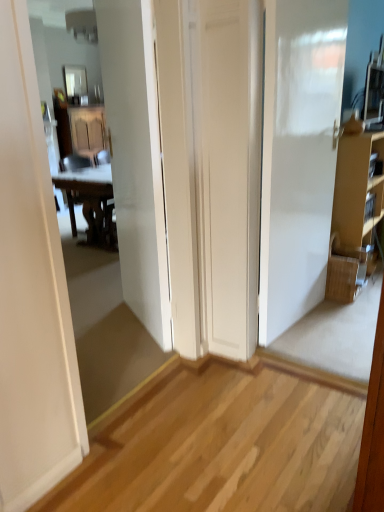
Question: From the image's perspective, relative to glossy glass mirror at upper center, is woven brown picnic basket at right above or below?

Choices:
 (A) below
 (B) above

Answer: (A)

Question: Is point (357, 278) positioned closer to the camera than point (86, 98)?

Choices:
 (A) closer
 (B) farther

Answer: (A)

Question: Which of these objects is positioned closest to the wooden at left?

Choices:
 (A) glossy glass mirror at upper center
 (B) woven brown picnic basket at right
 (C) white glossy door at center
 (D) brown cardboard cabinet at right

Answer: (C)

Question: Which of these objects is positioned closest to the brown cardboard cabinet at right?

Choices:
 (A) wooden at left
 (B) white glossy door at center
 (C) glossy glass mirror at upper center
 (D) woven brown picnic basket at right

Answer: (D)